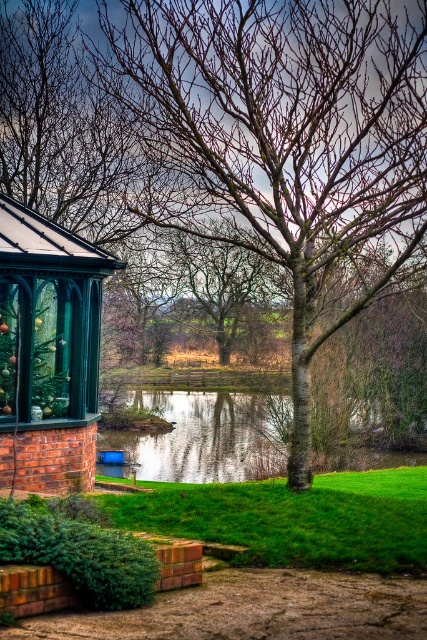
Is smooth bark tree at center to the right of reflective glass water at center from the viewer's perspective?

Incorrect, smooth bark tree at center is not on the right side of reflective glass water at center.

Who is more forward, (x=392, y=52) or (x=411, y=451)?

Point (x=392, y=52) is more forward.

Find the location of a particular element. This screenshot has width=427, height=640. smooth bark tree at center is located at coordinates (283, 145).

Is smooth bark tree at center further to camera compared to matte green gazebo at left?

No.

Is point (189, 93) positioned in front of point (73, 435)?

Yes, point (189, 93) is in front of point (73, 435).

Is point (167, 96) in front of point (43, 349)?

Yes, point (167, 96) is in front of point (43, 349).

Locate an element on the screen. The image size is (427, 640). smooth bark tree at center is located at coordinates (283, 145).

Can you confirm if reflective glass water at center is thinner than bare branches at center?

No.

Does point (183, 408) come in front of point (233, 332)?

No.

Find the location of `reflective glass water at center`. reflective glass water at center is located at coordinates (202, 436).